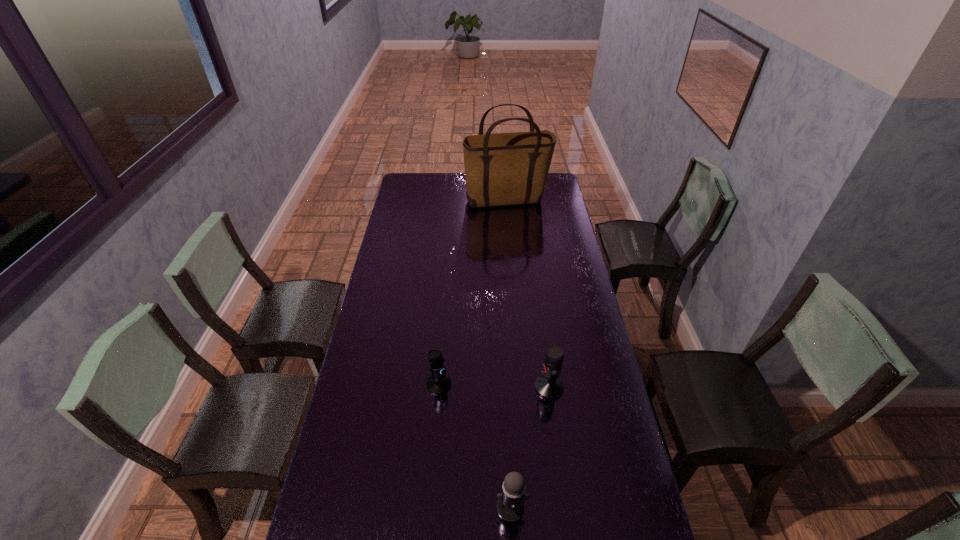
This screenshot has width=960, height=540. What are the coordinates of `vacant space located 0.270m on the side of the rightmost microphone with the red ring` in the screenshot? It's located at (453, 387).

Identify the location of vacant space located 0.330m on the side of the rightmost microphone with the red ring. The image size is (960, 540). (436, 387).

Identify the location of vacant space located on the front of the leftmost microphone. (428, 515).

You are a GUI agent. You are given a task and a screenshot of the screen. Output one action in this format:
    pyautogui.click(x=<x>, y=<y>)
    Task: Click on the object that is at the far edge
    This screenshot has height=540, width=960.
    Given the screenshot: What is the action you would take?
    pyautogui.click(x=502, y=169)

Locate an element on the screen. This screenshot has height=540, width=960. tote bag present at the right edge is located at coordinates (502, 169).

Find the location of `microphone situated at the right edge`. microphone situated at the right edge is located at coordinates (549, 385).

The height and width of the screenshot is (540, 960). In order to click on object at the far right corner in this screenshot , I will do tap(502, 169).

Find the location of a particular element. Image resolution: width=960 pixels, height=540 pixels. free space at the left edge is located at coordinates (407, 219).

Identify the location of vacant area at the right edge. Image resolution: width=960 pixels, height=540 pixels. (542, 204).

Find the location of `vacant area between the rightmost microphone and the second microphone from left to right`. vacant area between the rightmost microphone and the second microphone from left to right is located at coordinates (530, 447).